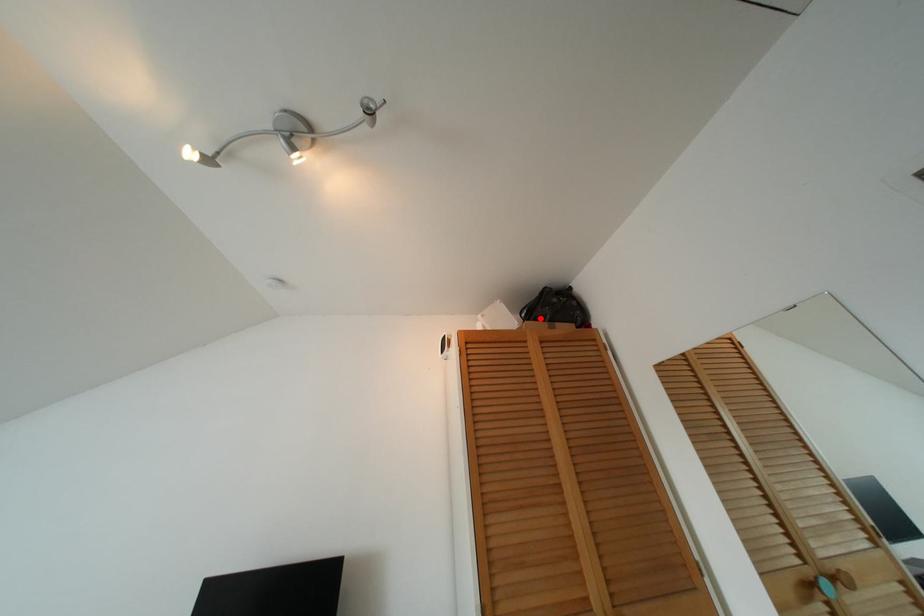
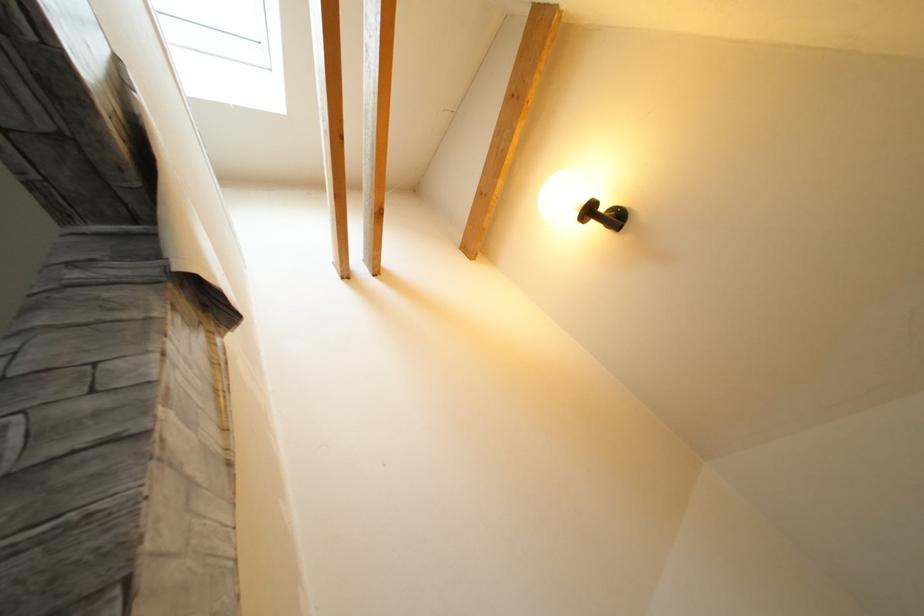
Question: I am providing you with two images of the same scene from different viewpoints. A red point is marked on the first image. Is the red point's position out of view in image 2?

Choices:
 (A) Yes
 (B) No

Answer: (A)